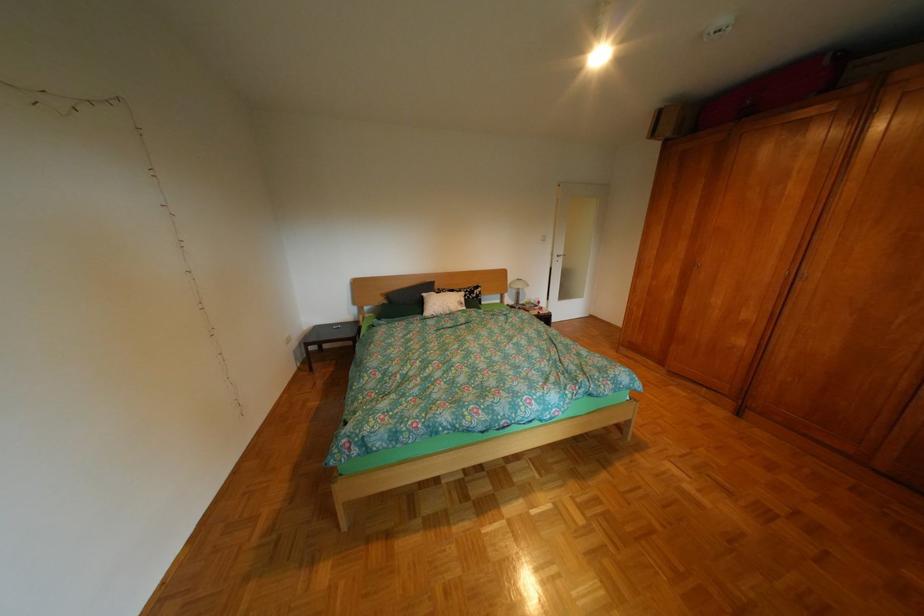
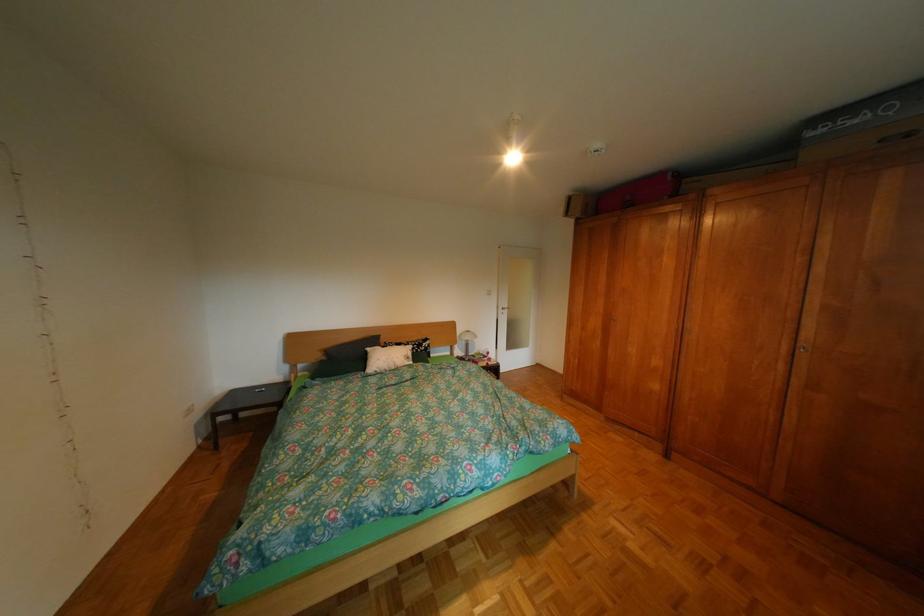
Question: How did the camera likely rotate?

Choices:
 (A) Left
 (B) Right
 (C) Up
 (D) Down

Answer: (C)